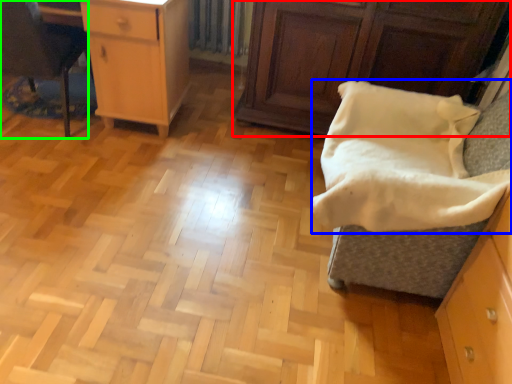
Question: Which object is positioned farthest from cabinetry (highlighted by a red box)? Select from blanket (highlighted by a blue box) and furniture (highlighted by a green box).

Choices:
 (A) blanket
 (B) furniture

Answer: (B)